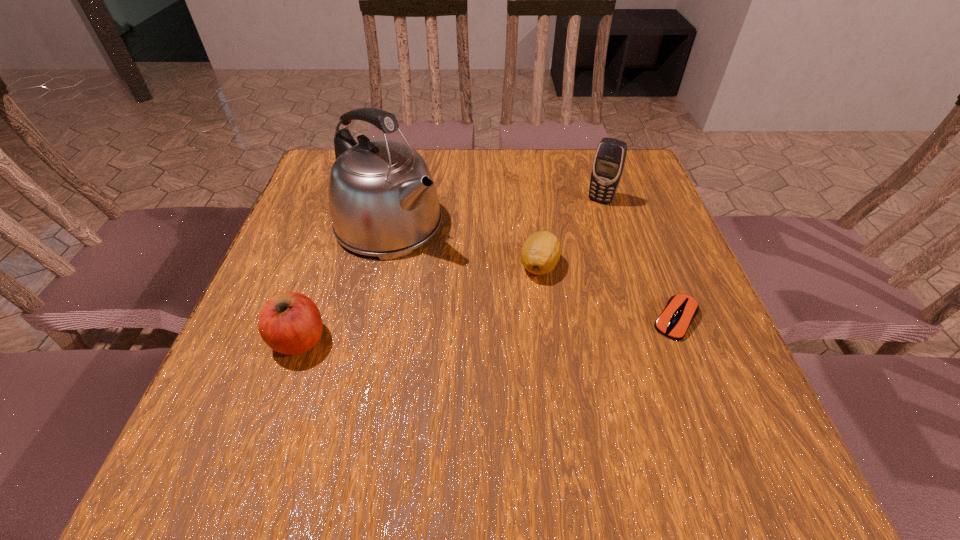
Identify the location of vacant region that satisfies the following two spatial constraints: 1. on the front side of the kettle; 2. on the left side of the fourth tallest object. (380, 266).

This screenshot has width=960, height=540. What are the coordinates of `free space that satisfies the following two spatial constraints: 1. on the back side of the shortest object; 2. on the left side of the apple` in the screenshot? It's located at (306, 319).

Locate an element on the screen. This screenshot has width=960, height=540. free space that satisfies the following two spatial constraints: 1. on the front side of the computer mouse; 2. on the right side of the cellular telephone is located at coordinates (638, 319).